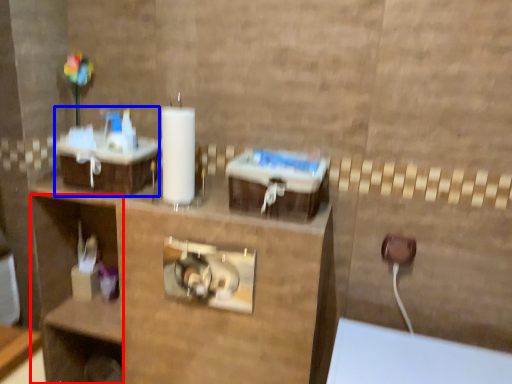
Question: Which object is further to the camera taking this photo, shelf (highlighted by a red box) or sink (highlighted by a blue box)?

Choices:
 (A) shelf
 (B) sink

Answer: (A)